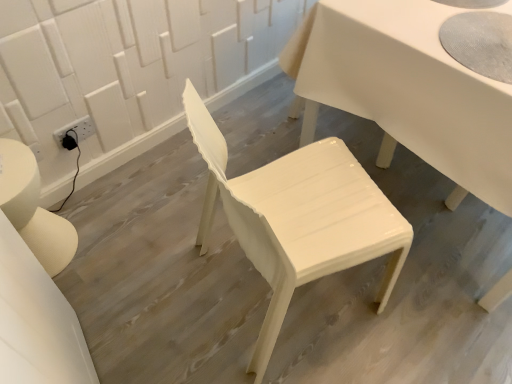
Question: From a real-world perspective, is glossy white table at center located beneath glossy white chair at center?

Choices:
 (A) no
 (B) yes

Answer: (B)

Question: Is glossy white table at center to the right of glossy white chair at center from the viewer's perspective?

Choices:
 (A) no
 (B) yes

Answer: (B)

Question: Could you tell me if glossy white table at center is turned towards glossy white chair at center?

Choices:
 (A) no
 (B) yes

Answer: (A)

Question: Does glossy white table at center appear on the left side of glossy white chair at center?

Choices:
 (A) no
 (B) yes

Answer: (A)

Question: Is glossy white table at center looking in the opposite direction of glossy white chair at center?

Choices:
 (A) yes
 (B) no

Answer: (B)

Question: Would you say glossy white table at center contains glossy white chair at center?

Choices:
 (A) yes
 (B) no

Answer: (B)

Question: Could glossy white table at center be considered to be inside glossy white chair at center?

Choices:
 (A) yes
 (B) no

Answer: (B)

Question: Is glossy white chair at center aimed at glossy white table at center?

Choices:
 (A) no
 (B) yes

Answer: (B)

Question: Is glossy white chair at center smaller than glossy white table at center?

Choices:
 (A) no
 (B) yes

Answer: (B)

Question: Does glossy white chair at center have a greater width compared to glossy white table at center?

Choices:
 (A) yes
 (B) no

Answer: (B)

Question: Would you consider glossy white chair at center to be distant from glossy white table at center?

Choices:
 (A) yes
 (B) no

Answer: (B)

Question: Is glossy white table at center at the back of glossy white chair at center?

Choices:
 (A) no
 (B) yes

Answer: (A)

Question: In terms of height, does glossy white chair at center look taller or shorter compared to glossy white table at center?

Choices:
 (A) tall
 (B) short

Answer: (A)